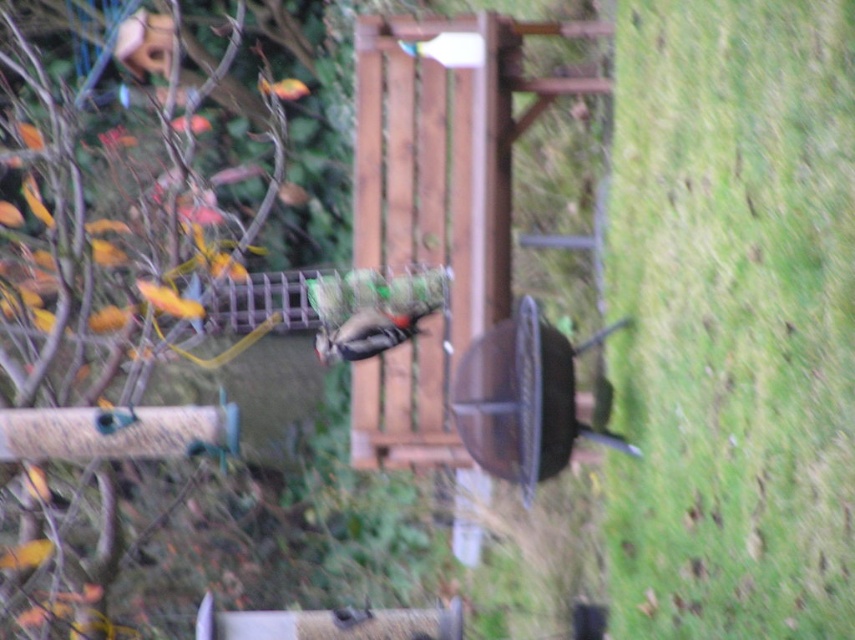
You are standing in the garden and want to place a new flower pot between the green matte bird feeder at left and the wooden bench to the right. Based on their positions, can you determine which object is closer to the center of the garden so that you can position the flower pot appropriately?

The green matte bird feeder at left is located at point (119, 292) which places it closer to the center of the garden compared to the wooden bench to the right. Therefore, the flower pot should be placed between them near the bird feeder to maintain balance.

You are a small robot with a 3.5 feet wide base. You need to move from the green matte bird feeder at left to the brown matte woodpecker at center. Can your base fit through the space between them?

The distance between the green matte bird feeder at left and the brown matte woodpecker at center is 5.42 feet, which is wider than your 3.5 feet base. Therefore, your base can fit through the space between them.

You are a photographer planning to capture a closeup shot of the green matte bird feeder at left while ensuring the green grass at lower right is still visible in the frame. Given their sizes, which object should you focus on first to ensure both are in focus?

The green grass at lower right has a smaller size compared to green matte bird feeder at left, so you should focus on the green matte bird feeder at left first since it is larger and will require more precise focus to capture details, while the smaller green grass at lower right will naturally stay in focus due to its size.